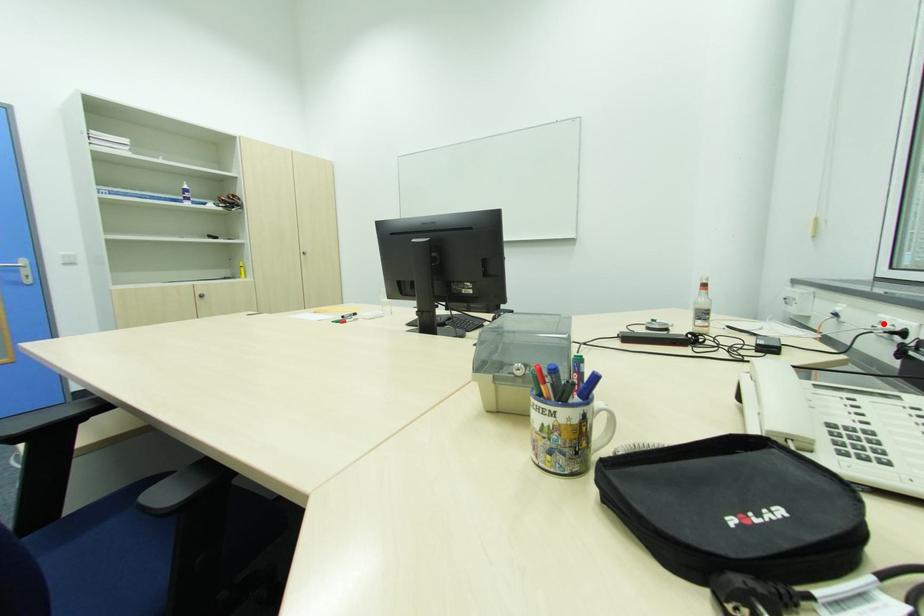
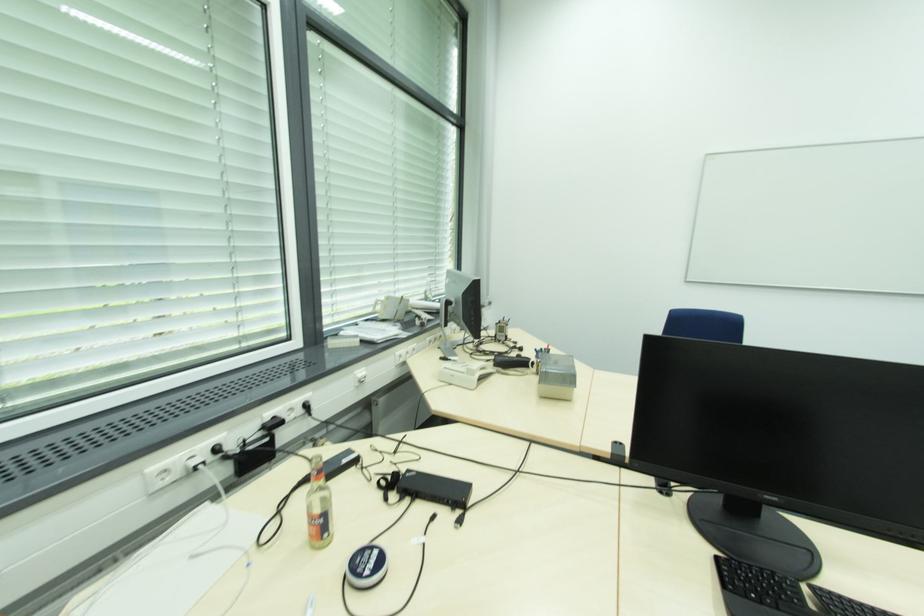
Locate, in the second image, the point that corresponds to the highlighted location in the first image.

(167, 472)